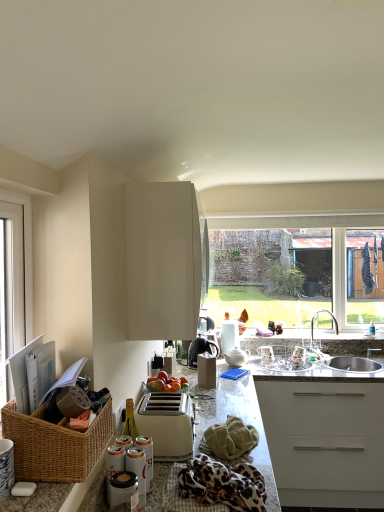
Question: From a real-world perspective, is green textured towel at lower center on white plastic toaster at center?

Choices:
 (A) yes
 (B) no

Answer: (B)

Question: Considering the relative positions of green textured towel at lower center and white plastic toaster at center in the image provided, is green textured towel at lower center to the left of white plastic toaster at center from the viewer's perspective?

Choices:
 (A) yes
 (B) no

Answer: (B)

Question: Considering the relative sizes of green textured towel at lower center and white plastic toaster at center in the image provided, is green textured towel at lower center smaller than white plastic toaster at center?

Choices:
 (A) no
 (B) yes

Answer: (B)

Question: Could you tell me if green textured towel at lower center is turned towards white plastic toaster at center?

Choices:
 (A) yes
 (B) no

Answer: (B)

Question: Could white plastic toaster at center be considered to be inside green textured towel at lower center?

Choices:
 (A) yes
 (B) no

Answer: (B)

Question: From the image's perspective, is green textured towel at lower center located beneath white plastic toaster at center?

Choices:
 (A) yes
 (B) no

Answer: (A)

Question: Is matte black coffee maker at center, positioned as the second appliance in left-to-right order, smaller than glossy white cabinet at upper center?

Choices:
 (A) yes
 (B) no

Answer: (A)

Question: Could you tell me if matte black coffee maker at center, which is counted as the 2th appliance, starting from the front, is facing glossy white cabinet at upper center?

Choices:
 (A) no
 (B) yes

Answer: (A)

Question: Can you confirm if matte black coffee maker at center, placed as the second appliance when sorted from back to front, is thinner than glossy white cabinet at upper center?

Choices:
 (A) yes
 (B) no

Answer: (A)

Question: From the image's perspective, is matte black coffee maker at center, which is the 2th appliance in right-to-left order, beneath glossy white cabinet at upper center?

Choices:
 (A) no
 (B) yes

Answer: (B)

Question: From a real-world perspective, is matte black coffee maker at center, which is the 2th appliance in right-to-left order, positioned under glossy white cabinet at upper center based on gravity?

Choices:
 (A) yes
 (B) no

Answer: (A)

Question: Is glossy white cabinet at upper center surrounded by matte black coffee maker at center, positioned as the second appliance in left-to-right order?

Choices:
 (A) yes
 (B) no

Answer: (B)

Question: Is green textured towel at lower center in front of granite countertop at center?

Choices:
 (A) yes
 (B) no

Answer: (B)